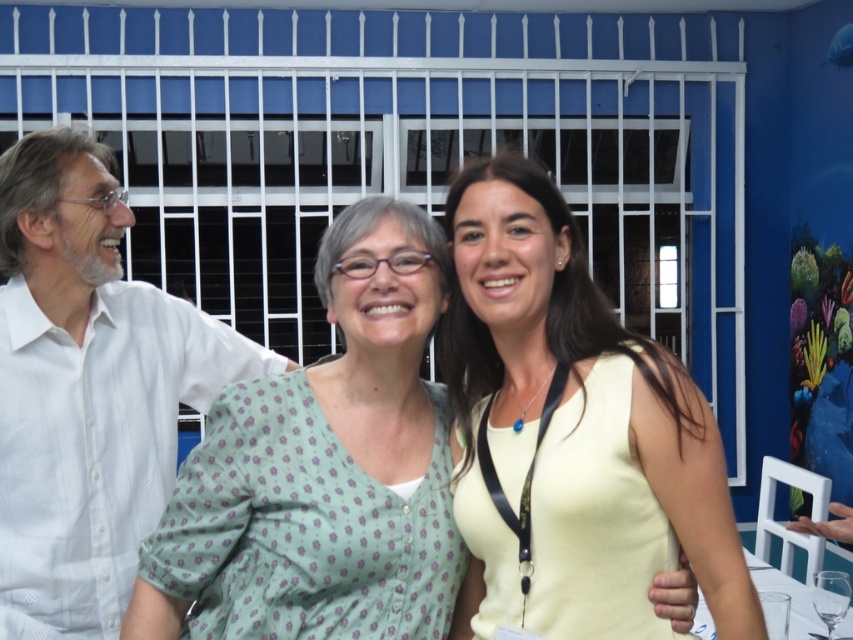
Question: Is yellow matte tank top at center further to camera compared to white textured shirt at left?

Choices:
 (A) yes
 (B) no

Answer: (B)

Question: Among these objects, which one is nearest to the camera?

Choices:
 (A) transparent glass at lower right
 (B) green floral blouse at center
 (C) white textured shirt at left

Answer: (B)

Question: Which object appears closest to the camera in this image?

Choices:
 (A) green floral blouse at center
 (B) white textured shirt at left
 (C) transparent glass at lower right
 (D) yellow matte tank top at center

Answer: (D)

Question: Is yellow matte tank top at center positioned in front of white textured shirt at left?

Choices:
 (A) yes
 (B) no

Answer: (A)

Question: Which object appears farthest from the camera in this image?

Choices:
 (A) green floral blouse at center
 (B) white textured shirt at left

Answer: (B)

Question: From the image, what is the correct spatial relationship of yellow matte tank top at center in relation to transparent glass at lower right?

Choices:
 (A) below
 (B) above

Answer: (B)